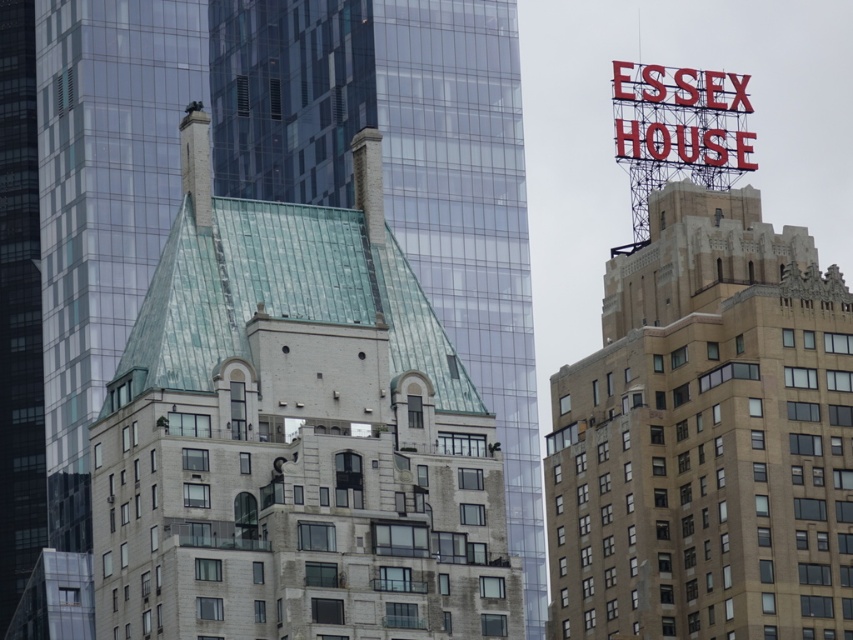
Question: Where is white brick building at center located in relation to beige stone building at upper right in the image?

Choices:
 (A) below
 (B) above

Answer: (B)

Question: Which of the following is the farthest from the observer?

Choices:
 (A) white brick building at center
 (B) beige stone building at upper right

Answer: (B)

Question: Does white brick building at center appear on the left side of beige stone building at upper right?

Choices:
 (A) no
 (B) yes

Answer: (B)

Question: Is white brick building at center thinner than beige stone building at upper right?

Choices:
 (A) no
 (B) yes

Answer: (A)

Question: Among these points, which one is nearest to the camera?

Choices:
 (A) (283, 602)
 (B) (691, 330)

Answer: (A)